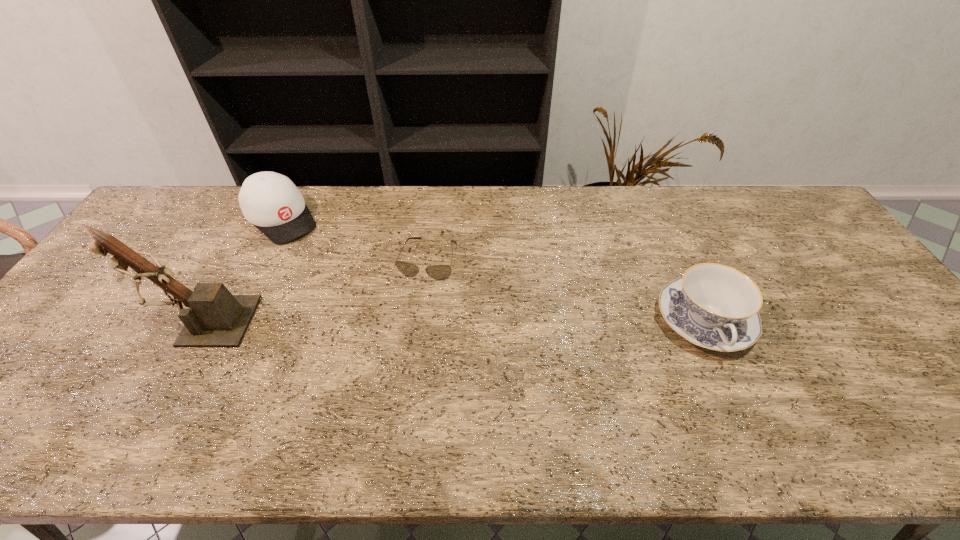
Image resolution: width=960 pixels, height=540 pixels. What are the coordinates of `vacant area that lies between the shortest object and the figurine` in the screenshot? It's located at (314, 290).

The height and width of the screenshot is (540, 960). What are the coordinates of `object that is the third nearest to the chinaware` in the screenshot? It's located at (217, 318).

Identify which object is the nearest to the sunglasses. Please provide its 2D coordinates. Your answer should be formatted as a tuple, i.e. [(x, y)], where the tuple contains the x and y coordinates of a point satisfying the conditions above.

[(270, 201)]